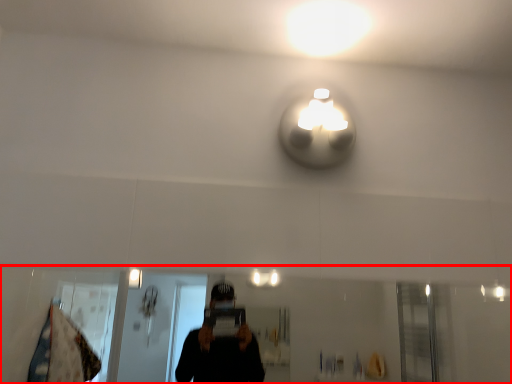
Question: From the image's perspective, where is mirror (annotated by the red box) located relative to light?

Choices:
 (A) above
 (B) below

Answer: (B)